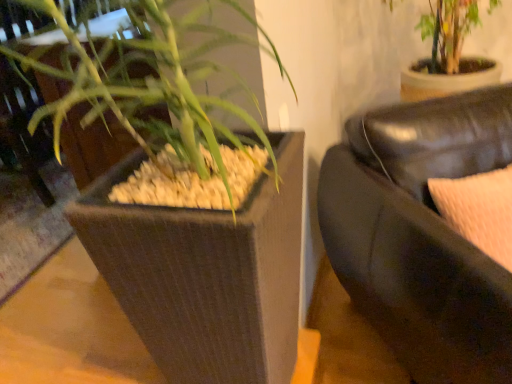
Question: Could you tell me if green leafy plant at upper left is turned towards brown textured planter at left?

Choices:
 (A) no
 (B) yes

Answer: (A)

Question: Is green leafy plant at upper left smaller than brown textured planter at left?

Choices:
 (A) yes
 (B) no

Answer: (B)

Question: Does green leafy plant at upper left appear on the left side of brown textured planter at left?

Choices:
 (A) no
 (B) yes

Answer: (A)

Question: Does green leafy plant at upper left have a lesser width compared to brown textured planter at left?

Choices:
 (A) no
 (B) yes

Answer: (B)

Question: Can you confirm if green leafy plant at upper left is shorter than brown textured planter at left?

Choices:
 (A) yes
 (B) no

Answer: (B)

Question: Is green leafy plant at upper left at the right side of brown textured planter at left?

Choices:
 (A) no
 (B) yes

Answer: (B)

Question: Does brown textured planter at left have a lesser height compared to black leather couch at right?

Choices:
 (A) yes
 (B) no

Answer: (A)

Question: Considering the relative sizes of brown textured planter at left and black leather couch at right in the image provided, is brown textured planter at left bigger than black leather couch at right?

Choices:
 (A) yes
 (B) no

Answer: (B)

Question: Is black leather couch at right surrounded by brown textured planter at left?

Choices:
 (A) yes
 (B) no

Answer: (B)

Question: Is brown textured planter at left oriented away from black leather couch at right?

Choices:
 (A) yes
 (B) no

Answer: (B)

Question: Would you consider brown textured planter at left to be distant from black leather couch at right?

Choices:
 (A) yes
 (B) no

Answer: (B)

Question: Are brown textured planter at left and black leather couch at right making contact?

Choices:
 (A) no
 (B) yes

Answer: (A)

Question: Is brown textured planter at left thinner than green leafy plant at upper left?

Choices:
 (A) no
 (B) yes

Answer: (A)